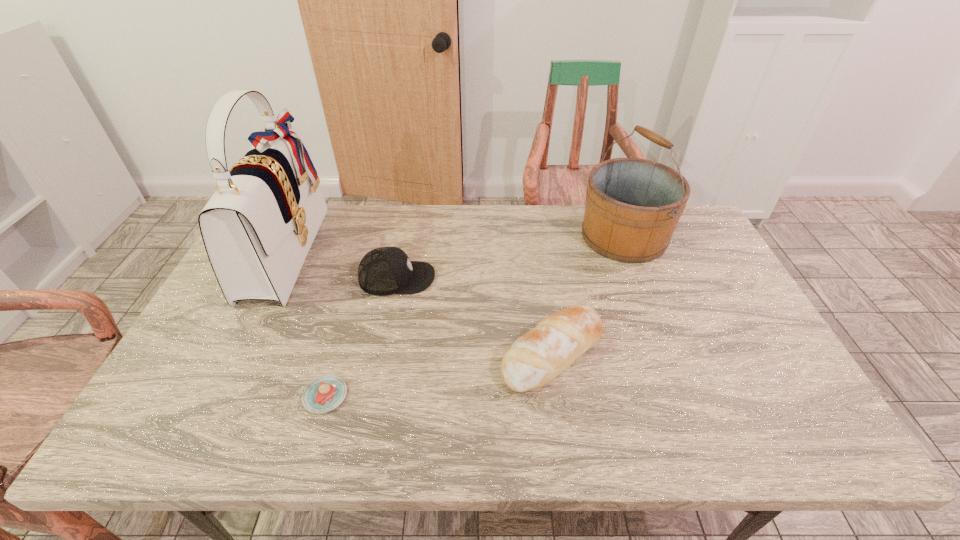
Where is `the tallest object`? This screenshot has height=540, width=960. the tallest object is located at coordinates (257, 228).

The height and width of the screenshot is (540, 960). I want to click on the leftmost object, so click(257, 228).

Locate an element on the screen. the rightmost object is located at coordinates (633, 205).

Identify the location of bucket. The image size is (960, 540). (633, 205).

What are the coordinates of `cap` in the screenshot? It's located at point(382,271).

This screenshot has height=540, width=960. I want to click on bread, so click(536, 358).

The image size is (960, 540). I want to click on the shortest object, so click(x=325, y=393).

Find the location of a particular element. The height and width of the screenshot is (540, 960). free space located on the front-facing side of the satchel is located at coordinates (360, 251).

The image size is (960, 540). I want to click on free space located 0.120m on the left of the bucket, so click(x=543, y=237).

Where is `vacant space located on the front-facing side of the cap`? The height and width of the screenshot is (540, 960). vacant space located on the front-facing side of the cap is located at coordinates (538, 278).